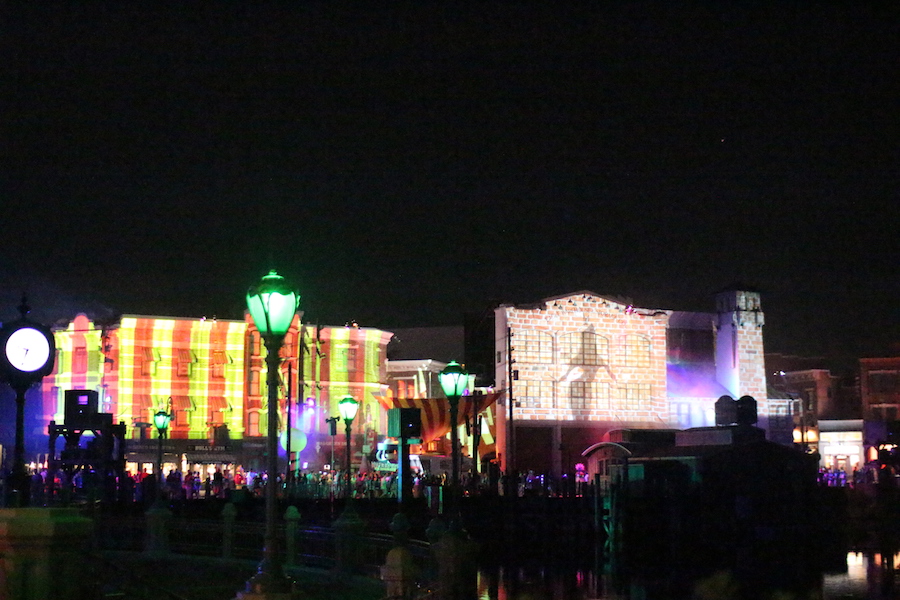
Locate an element on the screen. Image resolution: width=900 pixels, height=600 pixels. green light globes is located at coordinates (284, 310), (162, 420), (451, 383), (348, 407).